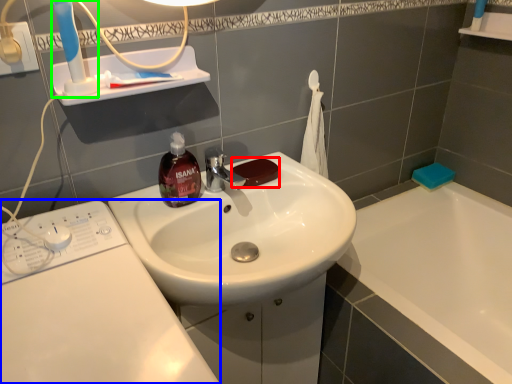
Question: Which is farther away from soap (highlighted by a red box)? washing machine (highlighted by a blue box) or toothbrush (highlighted by a green box)?

Choices:
 (A) washing machine
 (B) toothbrush

Answer: (A)